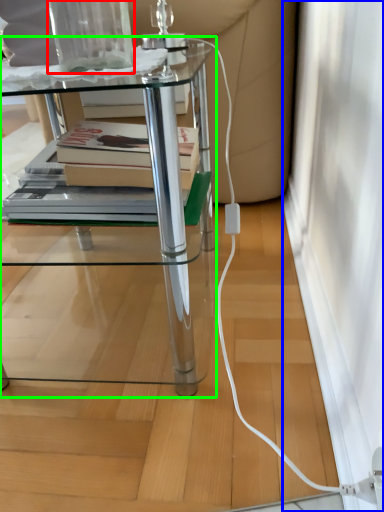
Question: Which object is the closest to the glass vase (highlighted by a red box)? Choose among these: screen door (highlighted by a blue box) or table (highlighted by a green box).

Choices:
 (A) screen door
 (B) table

Answer: (B)